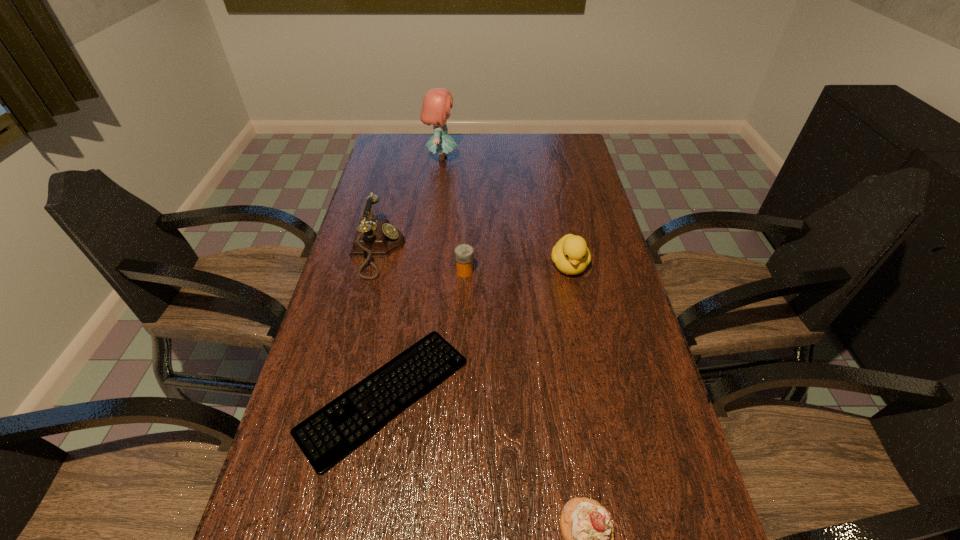
Where is `vacant space that satisfies the following two spatial constraints: 1. on the dial of the second nearest object; 2. on the left side of the telephone`? vacant space that satisfies the following two spatial constraints: 1. on the dial of the second nearest object; 2. on the left side of the telephone is located at coordinates (343, 396).